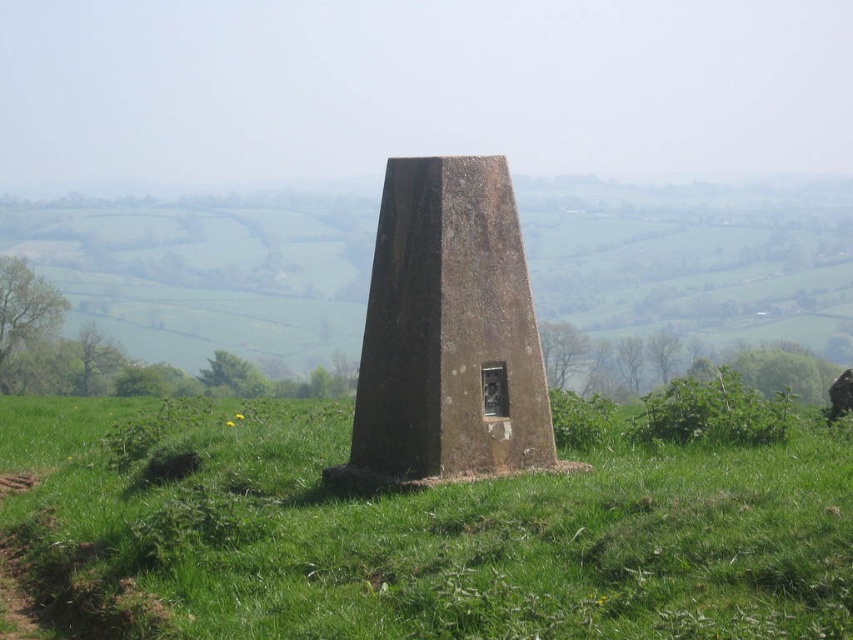
Who is more forward, (556,624) or (422,444)?

Point (556,624) is more forward.

Can you confirm if green grassy at center is taller than brown stone monument at center?

In fact, green grassy at center may be shorter than brown stone monument at center.

Does point (167, 561) lie in front of point (445, 257)?

Yes, it is in front of point (445, 257).

Locate an element on the screen. This screenshot has height=640, width=853. green grassy at center is located at coordinates (415, 534).